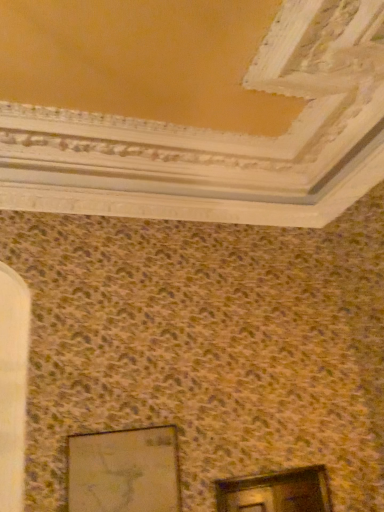
Question: In terms of height, does matte glass window at lower center look taller or shorter compared to matte glass picture frame at lower left?

Choices:
 (A) tall
 (B) short

Answer: (B)

Question: Is matte glass window at lower center situated inside matte glass picture frame at lower left or outside?

Choices:
 (A) inside
 (B) outside

Answer: (B)

Question: From the image's perspective, is matte glass window at lower center above or below matte glass picture frame at lower left?

Choices:
 (A) below
 (B) above

Answer: (A)

Question: Considering the positions of matte glass picture frame at lower left and matte glass window at lower center in the image, is matte glass picture frame at lower left wider or thinner than matte glass window at lower center?

Choices:
 (A) thin
 (B) wide

Answer: (A)

Question: From the image's perspective, relative to matte glass window at lower center, is matte glass picture frame at lower left above or below?

Choices:
 (A) below
 (B) above

Answer: (B)

Question: Is matte glass picture frame at lower left in front of or behind matte glass window at lower center in the image?

Choices:
 (A) front
 (B) behind

Answer: (A)

Question: Is point (109, 466) closer or farther from the camera than point (233, 507)?

Choices:
 (A) farther
 (B) closer

Answer: (B)